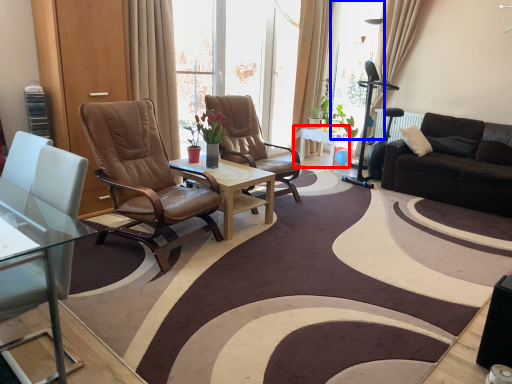
Question: Which object appears closest to the camera in this image, table (highlighted by a red box) or window screen (highlighted by a blue box)?

Choices:
 (A) table
 (B) window screen

Answer: (A)